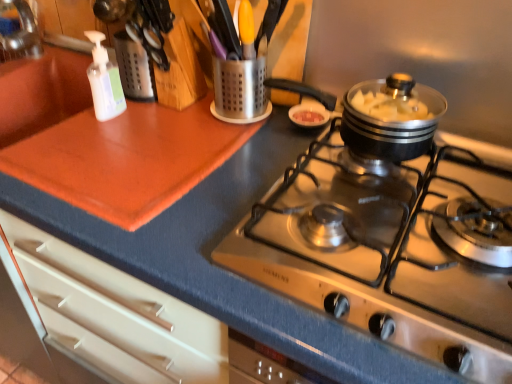
Locate an element on the screen. The width and height of the screenshot is (512, 384). vacant space to the right of white translucent bottle at upper left is located at coordinates click(173, 131).